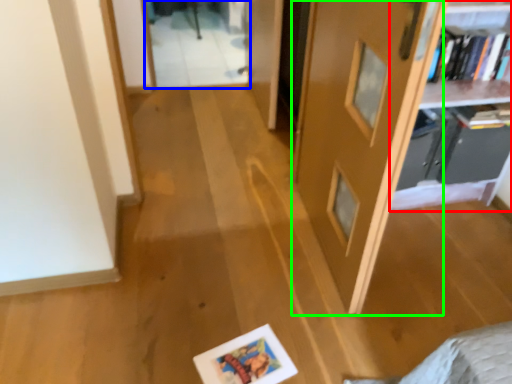
Question: Estimate the real-world distances between objects in this image. Which object is farther from shelf (highlighted by a red box), glass door (highlighted by a blue box) or door (highlighted by a green box)?

Choices:
 (A) glass door
 (B) door

Answer: (A)